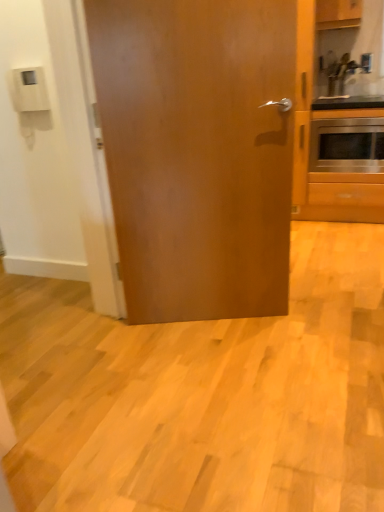
Question: From the image's perspective, is metallic silver sink at upper right located beneath stainless steel oven at right?

Choices:
 (A) yes
 (B) no

Answer: (B)

Question: Does metallic silver sink at upper right appear on the left side of stainless steel oven at right?

Choices:
 (A) no
 (B) yes

Answer: (B)

Question: Does metallic silver sink at upper right have a greater height compared to stainless steel oven at right?

Choices:
 (A) yes
 (B) no

Answer: (B)

Question: Does metallic silver sink at upper right have a greater width compared to stainless steel oven at right?

Choices:
 (A) no
 (B) yes

Answer: (A)

Question: Is metallic silver sink at upper right facing away from stainless steel oven at right?

Choices:
 (A) yes
 (B) no

Answer: (B)

Question: Considering the relative positions of stainless steel oven at right and glossy wood door at center in the image provided, is stainless steel oven at right to the left or to the right of glossy wood door at center?

Choices:
 (A) right
 (B) left

Answer: (A)

Question: In terms of height, does stainless steel oven at right look taller or shorter compared to glossy wood door at center?

Choices:
 (A) short
 (B) tall

Answer: (A)

Question: From a real-world perspective, relative to glossy wood door at center, is stainless steel oven at right vertically above or below?

Choices:
 (A) above
 (B) below

Answer: (B)

Question: From the image's perspective, is stainless steel oven at right above or below glossy wood door at center?

Choices:
 (A) below
 (B) above

Answer: (B)

Question: Considering their positions, is wooden cabinet at upper right located in front of or behind stainless steel oven at right?

Choices:
 (A) behind
 (B) front

Answer: (B)

Question: From the image's perspective, is wooden cabinet at upper right located above or below stainless steel oven at right?

Choices:
 (A) below
 (B) above

Answer: (B)

Question: Is wooden cabinet at upper right to the left or to the right of stainless steel oven at right in the image?

Choices:
 (A) right
 (B) left

Answer: (B)

Question: Choose the correct answer: Is wooden cabinet at upper right inside stainless steel oven at right or outside it?

Choices:
 (A) outside
 (B) inside

Answer: (A)

Question: Is metallic silver sink at upper right taller or shorter than wooden cabinet at upper right?

Choices:
 (A) tall
 (B) short

Answer: (A)

Question: Is metallic silver sink at upper right spatially inside wooden cabinet at upper right, or outside of it?

Choices:
 (A) inside
 (B) outside

Answer: (B)